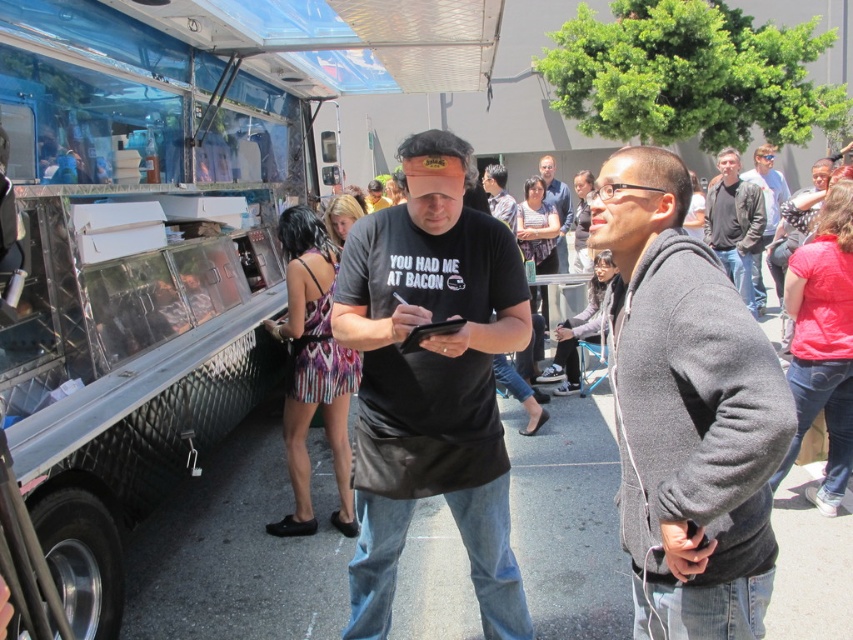
Question: Which object appears farthest from the camera in this image?

Choices:
 (A) black t-shirt at center
 (B) dark gray jacket at upper right

Answer: (B)

Question: Which point appears closest to the camera in this image?

Choices:
 (A) (656, 280)
 (B) (761, 304)
 (C) (726, 236)
 (D) (498, 438)

Answer: (A)

Question: Can you confirm if gray fleece hoodie at right is positioned above matte black t-shirt at center?

Choices:
 (A) yes
 (B) no

Answer: (B)

Question: Does gray fleece hoodie at right have a larger size compared to dark gray hoodie at center?

Choices:
 (A) no
 (B) yes

Answer: (A)

Question: Can you confirm if black t-shirt at center is bigger than dark gray jacket at upper right?

Choices:
 (A) no
 (B) yes

Answer: (A)

Question: Which of the following is the farthest from the observer?

Choices:
 (A) matte black t-shirt at center
 (B) brushed metal food truck at left

Answer: (A)